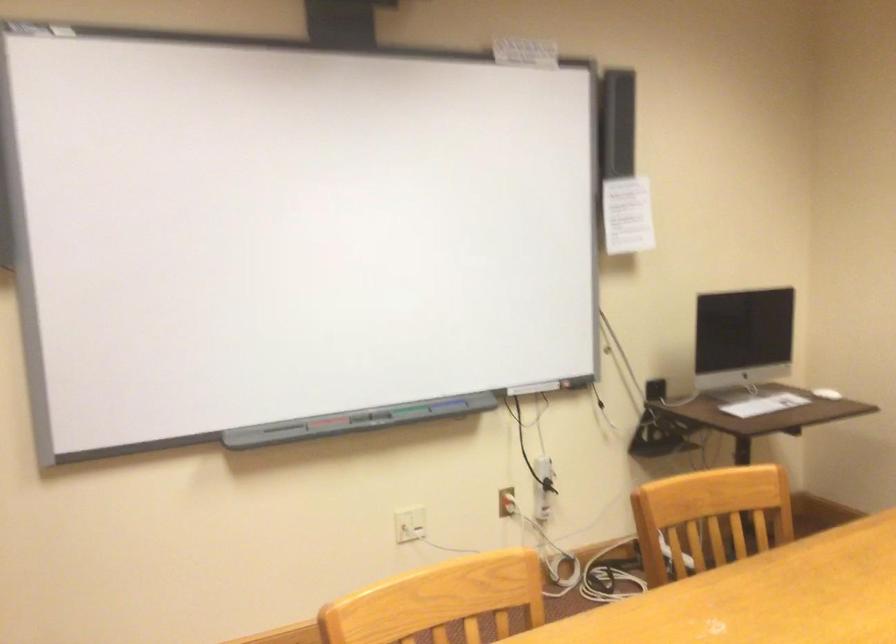
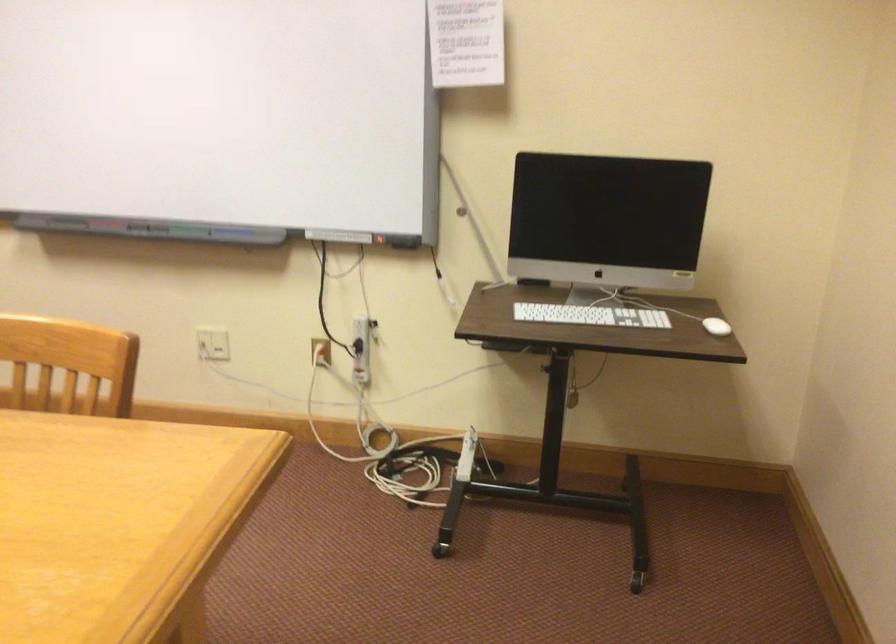
The point at (506, 500) is marked in the first image. Where is the corresponding point in the second image?

(321, 351)